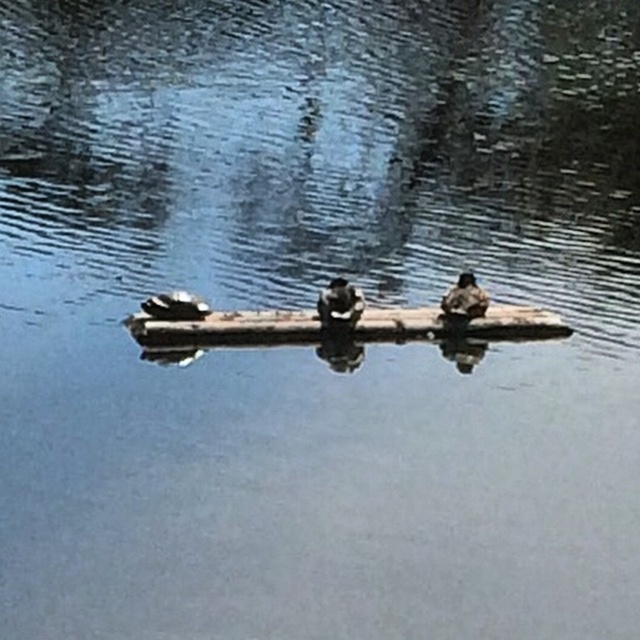
You are a photographer aiming to capture the brown matte duck at center in your shot. If your camera is positioned at the origin point, which is the closest point to the duck?

The closest point to the brown matte duck at center is at coordinates point (339, 304).

You are a wildlife photographer aiming to capture the brown matte duck at center and the dark brown feathers at center in a single shot. Based on their positions, which object is positioned to the right side of the other?

The brown matte duck at center is to the right of the dark brown feathers at center.

You are a wildlife photographer aiming to capture the brown matte duck at center and the dark brown feathers at center in a single frame. Given that your camera can only focus on objects wider than 10 cm, will both subjects meet the focus requirement?

The brown matte duck at center has a lesser width compared to dark brown feathers at center. However, without specific measurements, it is impossible to determine if both are wider than 10 cm. Additional information is needed.